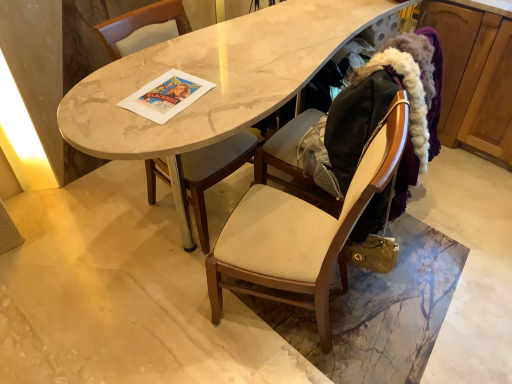
Question: Looking at their shapes, would you say marble table at center is wider or thinner than beige fabric chair at center, the first chair in the right-to-left sequence?

Choices:
 (A) wide
 (B) thin

Answer: (A)

Question: From the image's perspective, is marble table at center above or below beige fabric chair at center, marked as the 2th chair in a left-to-right arrangement?

Choices:
 (A) above
 (B) below

Answer: (A)

Question: Estimate the real-world distances between objects in this image. Which object is farther from the marble table at center?

Choices:
 (A) wooden cabinet at right
 (B) matte gray cushioned chair at center, marked as the first chair in a left-to-right arrangement
 (C) beige fabric folding chair at right
 (D) beige fabric chair at center, marked as the 2th chair in a left-to-right arrangement

Answer: (A)

Question: Which object is the closest to the beige fabric folding chair at right?

Choices:
 (A) wooden cabinet at right
 (B) matte gray cushioned chair at center, which appears as the 2th chair when viewed from the right
 (C) beige fabric chair at center, the first chair in the right-to-left sequence
 (D) marble table at center

Answer: (C)